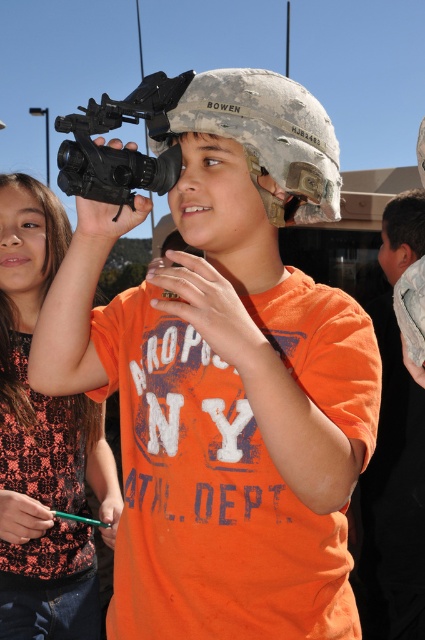
Question: Is orange lace shirt at upper left smaller than black matte gun at center?

Choices:
 (A) no
 (B) yes

Answer: (A)

Question: Is orange lace shirt at upper left in front of black matte gun at center?

Choices:
 (A) yes
 (B) no

Answer: (B)

Question: Is orange lace shirt at upper left thinner than black matte gun at center?

Choices:
 (A) no
 (B) yes

Answer: (A)

Question: Which of the following is the farthest from the observer?

Choices:
 (A) orange lace shirt at upper left
 (B) black matte gun at center

Answer: (A)

Question: Among these points, which one is nearest to the camera?

Choices:
 (A) (3, 269)
 (B) (141, 177)

Answer: (B)

Question: Which point is closer to the camera taking this photo?

Choices:
 (A) pyautogui.click(x=0, y=348)
 (B) pyautogui.click(x=116, y=202)

Answer: (B)